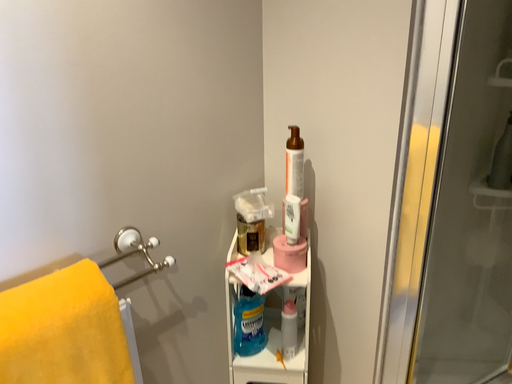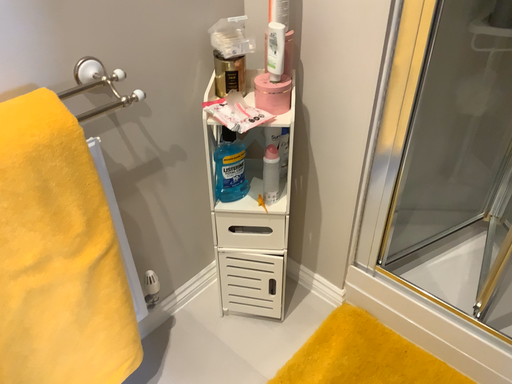
Question: How did the camera likely rotate when shooting the video?

Choices:
 (A) rotated downward
 (B) rotated upward

Answer: (A)